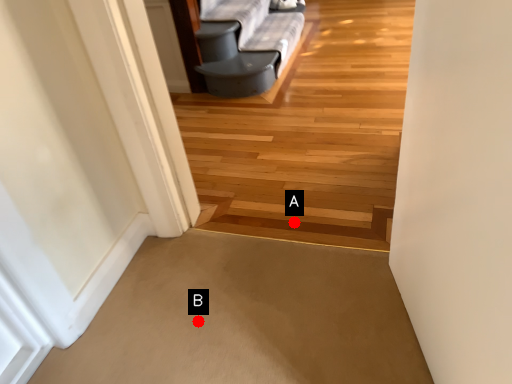
Question: Two points are circled on the image, labeled by A and B beside each circle. Among these points, which one is nearest to the camera?

Choices:
 (A) A is closer
 (B) B is closer

Answer: (B)